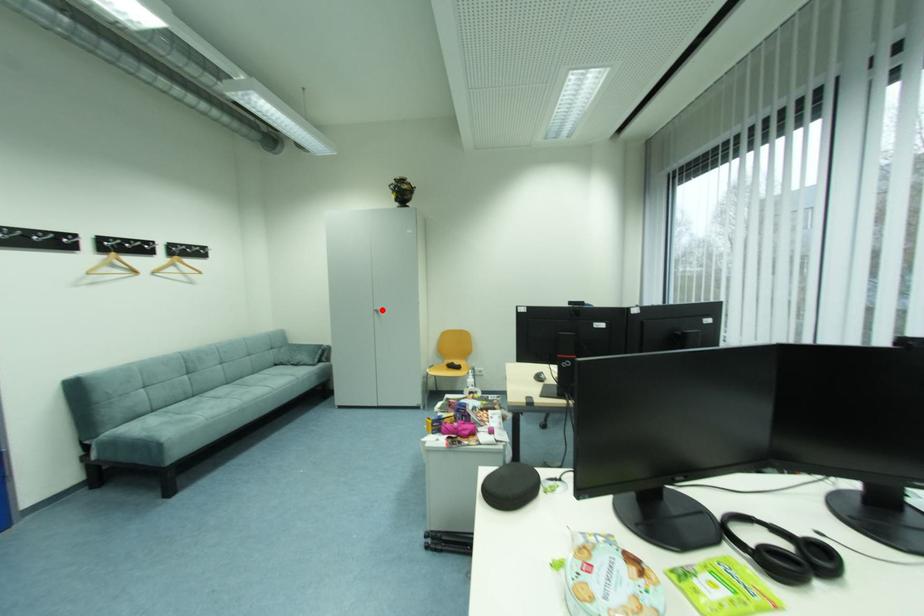
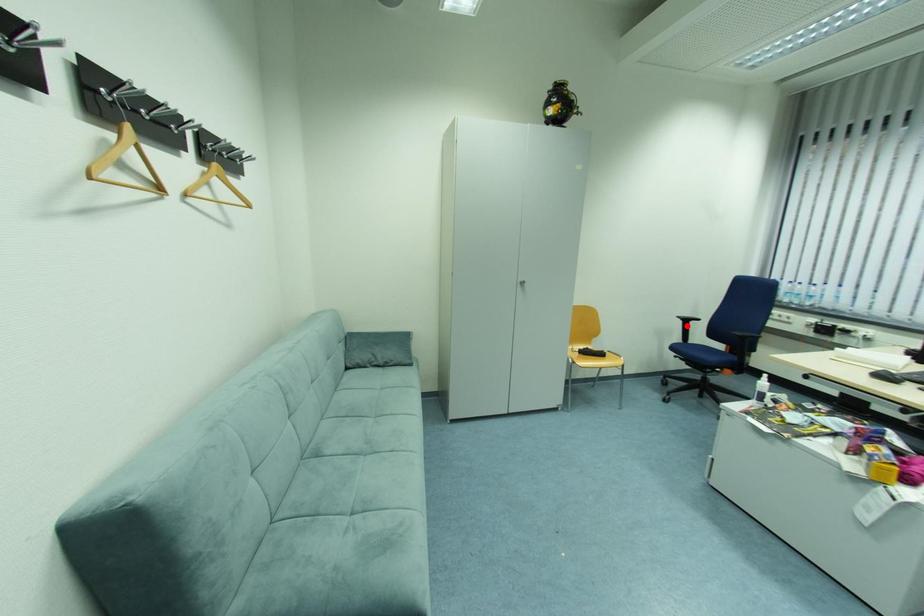
I am providing you with two images of the same scene from different viewpoints. A red point is marked on the first image and another point is marked on the second image. Is the marked point in image1 the same physical position as the marked point in image2?

No